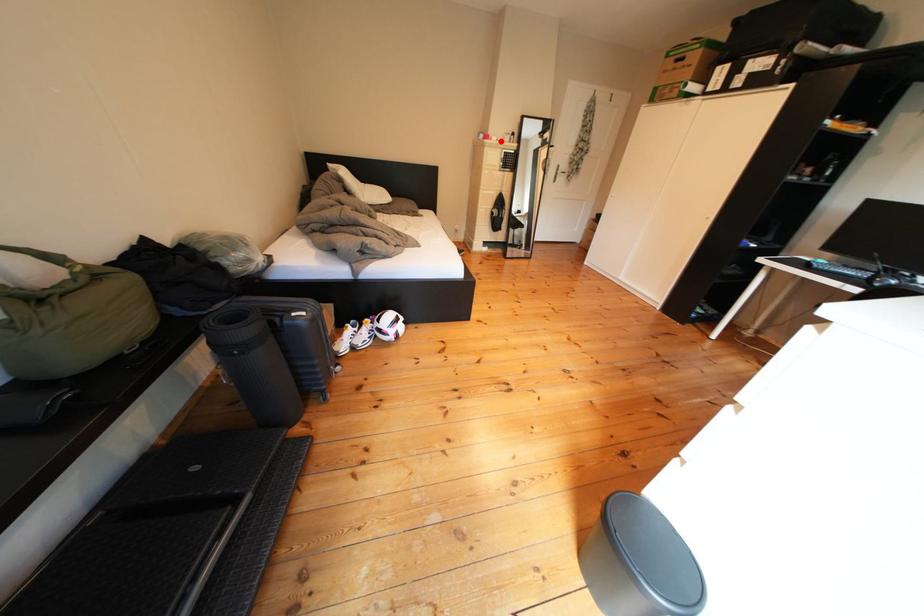
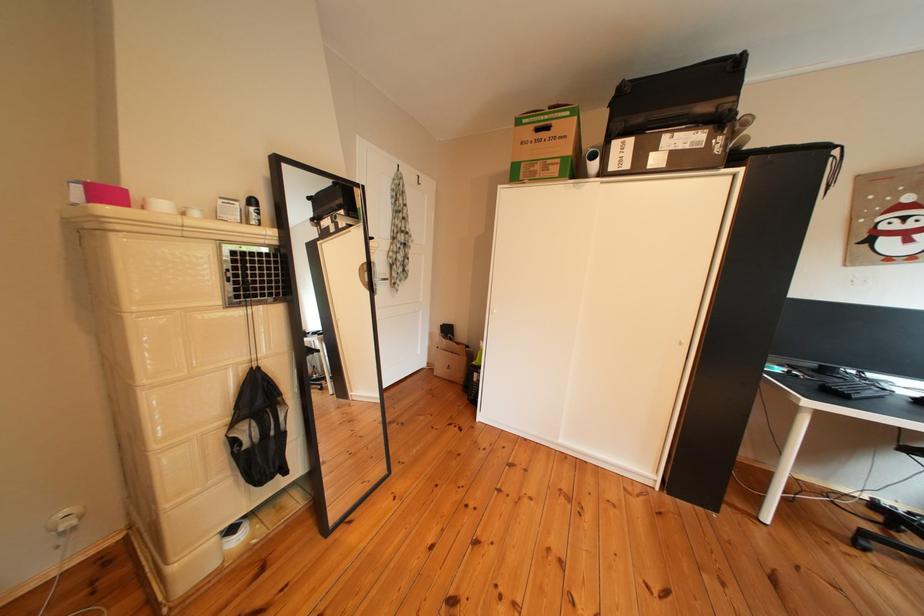
Find the pixel in the second image that matches the highlighted location in the first image.

(123, 199)